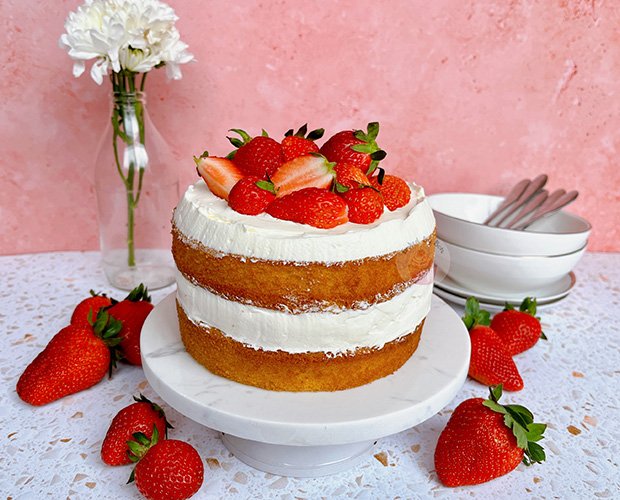
At what (x,y) coordinates should I click in order to perform the action: click on bowls. Please return your answer as a coordinate pair (x, y). The image size is (620, 500). Looking at the image, I should click on (529, 237), (513, 270).